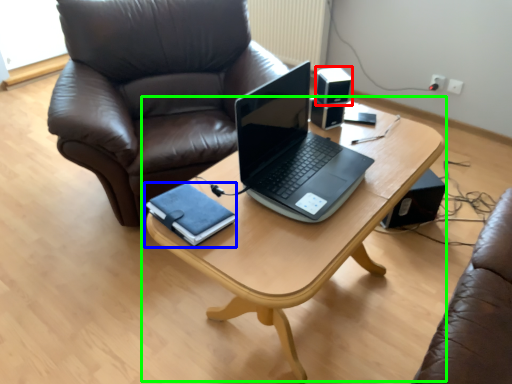
Question: Considering the real-world distances, which object is closest to speaker (highlighted by a red box)? notebook (highlighted by a blue box) or table (highlighted by a green box).

Choices:
 (A) notebook
 (B) table

Answer: (B)